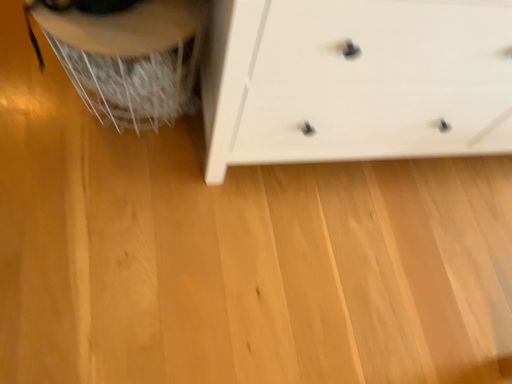
Question: Visually, is white plastic swivel chair at left positioned to the left or to the right of white matte chest of drawers at center?

Choices:
 (A) left
 (B) right

Answer: (A)

Question: Considering the positions of white plastic swivel chair at left and white matte chest of drawers at center in the image, is white plastic swivel chair at left taller or shorter than white matte chest of drawers at center?

Choices:
 (A) short
 (B) tall

Answer: (A)

Question: Based on their sizes in the image, would you say white plastic swivel chair at left is bigger or smaller than white matte chest of drawers at center?

Choices:
 (A) small
 (B) big

Answer: (A)

Question: Considering the positions of white matte chest of drawers at center and white plastic swivel chair at left in the image, is white matte chest of drawers at center taller or shorter than white plastic swivel chair at left?

Choices:
 (A) short
 (B) tall

Answer: (B)

Question: From the image's perspective, is white matte chest of drawers at center above or below white plastic swivel chair at left?

Choices:
 (A) above
 (B) below

Answer: (A)

Question: In the image, is white matte chest of drawers at center positioned in front of or behind white plastic swivel chair at left?

Choices:
 (A) front
 (B) behind

Answer: (A)

Question: Considering the positions of white matte chest of drawers at center and white plastic swivel chair at left in the image, is white matte chest of drawers at center wider or thinner than white plastic swivel chair at left?

Choices:
 (A) wide
 (B) thin

Answer: (A)